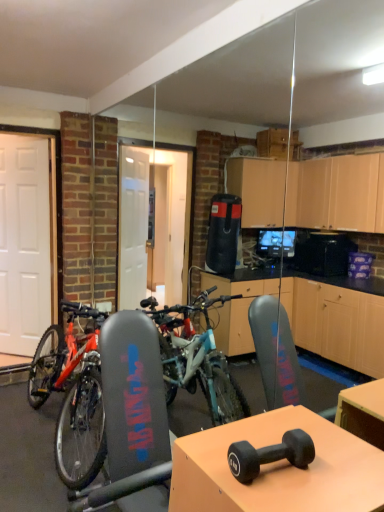
Question: Could you tell me if matte black dumbbell at center is facing black rubber dumbbell at center?

Choices:
 (A) yes
 (B) no

Answer: (B)

Question: From the image's perspective, does matte black dumbbell at center appear lower than black rubber dumbbell at center?

Choices:
 (A) yes
 (B) no

Answer: (A)

Question: Is matte black dumbbell at center placed right next to black rubber dumbbell at center?

Choices:
 (A) no
 (B) yes

Answer: (A)

Question: Is matte black dumbbell at center outside black rubber dumbbell at center?

Choices:
 (A) no
 (B) yes

Answer: (B)

Question: From a real-world perspective, is matte black dumbbell at center on top of black rubber dumbbell at center?

Choices:
 (A) no
 (B) yes

Answer: (A)

Question: From their relative heights in the image, would you say matte black dumbbell at center is taller or shorter than black rubber dumbbell at center?

Choices:
 (A) short
 (B) tall

Answer: (B)

Question: Is point pos(231,500) closer or farther from the camera than point pos(273,446)?

Choices:
 (A) farther
 (B) closer

Answer: (B)

Question: From a real-world perspective, is matte black dumbbell at center positioned above or below black rubber dumbbell at center?

Choices:
 (A) below
 (B) above

Answer: (A)

Question: Looking at their shapes, would you say matte black dumbbell at center is wider or thinner than black rubber dumbbell at center?

Choices:
 (A) thin
 (B) wide

Answer: (B)

Question: Looking at their shapes, would you say teal matte bicycle at center is wider or thinner than black rubber dumbbell at center?

Choices:
 (A) wide
 (B) thin

Answer: (A)

Question: From the image's perspective, relative to black rubber dumbbell at center, is teal matte bicycle at center above or below?

Choices:
 (A) below
 (B) above

Answer: (A)

Question: Is point (76, 460) positioned closer to the camera than point (296, 448)?

Choices:
 (A) closer
 (B) farther

Answer: (B)

Question: Based on their sizes in the image, would you say teal matte bicycle at center is bigger or smaller than black rubber dumbbell at center?

Choices:
 (A) big
 (B) small

Answer: (A)

Question: Which is correct: black rubber dumbbell at center is inside teal matte bicycle at center, or outside of it?

Choices:
 (A) outside
 (B) inside

Answer: (A)

Question: Looking at the image, does black rubber dumbbell at center seem bigger or smaller compared to teal matte bicycle at center?

Choices:
 (A) big
 (B) small

Answer: (B)